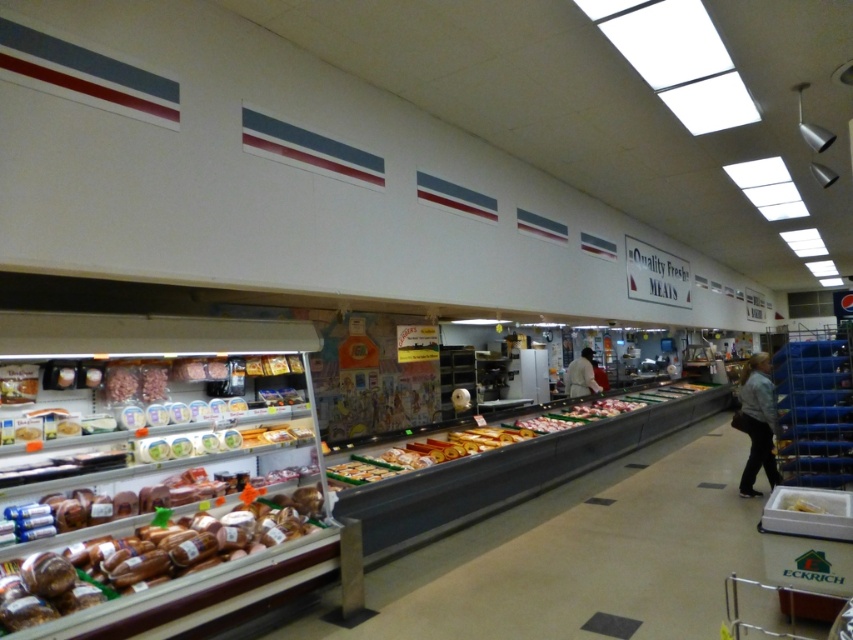
Question: Is brown glossy bread at lower left further to camera compared to white matte coat at center?

Choices:
 (A) yes
 (B) no

Answer: (B)

Question: Is the position of denim jacket at lower right less distant than that of white matte coat at center?

Choices:
 (A) no
 (B) yes

Answer: (B)

Question: Based on their relative distances, which object is nearer to the yellow matte cheese at center?

Choices:
 (A) brown glossy bread at lower left
 (B) white matte coat at center
 (C) denim jacket at lower right

Answer: (C)

Question: Which of the following is the farthest from the observer?

Choices:
 (A) denim jacket at lower right
 (B) yellow matte cheese at center

Answer: (A)

Question: Does brown glossy bread at lower left have a greater width compared to denim jacket at lower right?

Choices:
 (A) no
 (B) yes

Answer: (B)

Question: Among these points, which one is farthest from the camera?

Choices:
 (A) (746, 365)
 (B) (587, 368)
 (C) (115, 586)

Answer: (B)